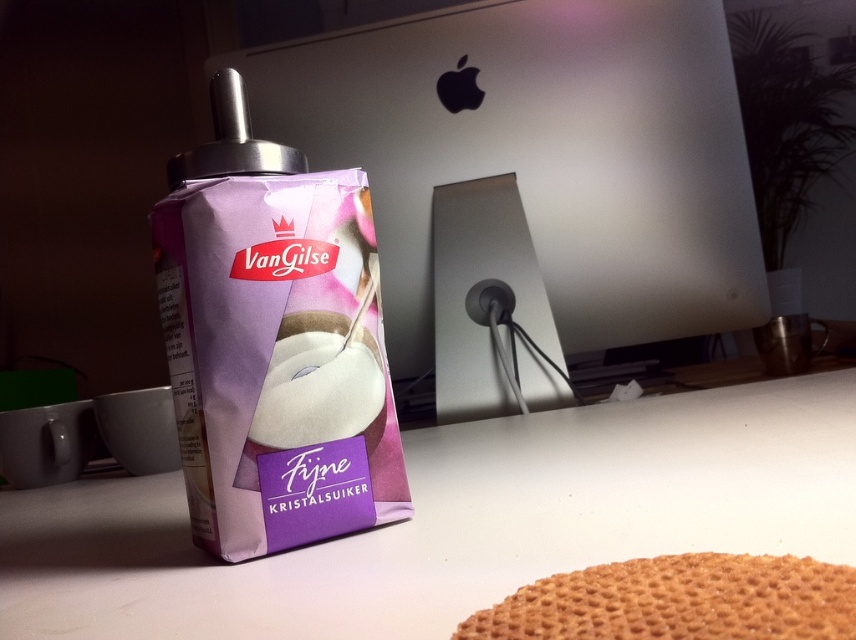
You are standing in front of the white matte table at center and want to place a golden textured wafer. Since the golden textured wafer at lower right is closer to you, where should you place it?

The golden textured wafer at lower right is closer to you than the white matte table at center, so you should place it on the white matte table at center which is further away.

You are organizing items on a desk and need to place both the white matte table at center and the golden textured wafer at lower right. Considering their sizes, which object should you place first to ensure they both fit on the desk?

The white matte table at center should be placed first since its width is greater than the golden textured wafer at lower right, allowing more space for the smaller object afterward.